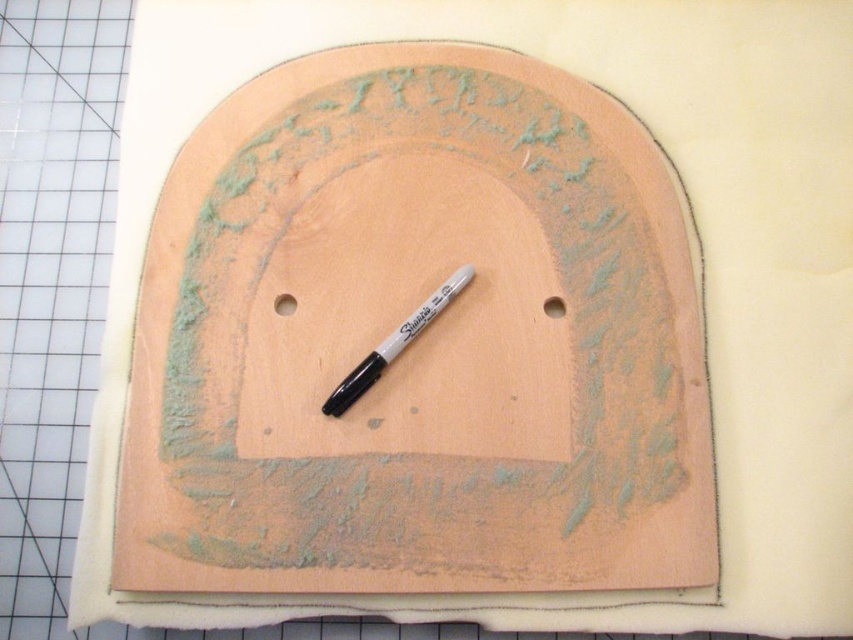
Is matte wood hole at center positioned at the back of smooth orange wood hole at center?

No, matte wood hole at center is in front of smooth orange wood hole at center.

Between point (281, 294) and point (546, 310), which one is positioned in front?

Positioned in front is point (281, 294).

Where is `matte wood hole at center`? Image resolution: width=853 pixels, height=640 pixels. matte wood hole at center is located at coordinates (283, 305).

Can you confirm if black marker at center is positioned below matte wood hole at center?

Indeed, black marker at center is positioned under matte wood hole at center.

Which is in front, point (358, 397) or point (280, 305)?

Point (358, 397)

Is point (462, 276) positioned before point (280, 312)?

No, it is not.

At what (x,y) coordinates should I click in order to perform the action: click on black marker at center. Please return your answer as a coordinate pair (x, y). Image resolution: width=853 pixels, height=640 pixels. Looking at the image, I should click on (x=393, y=344).

Does peach wood board at center come in front of matte wood hole at center?

Yes.

Is peach wood board at center above matte wood hole at center?

No.

Is point (289, 428) less distant than point (276, 304)?

Yes, it is in front of point (276, 304).

The image size is (853, 640). I want to click on peach wood board at center, so click(x=416, y=340).